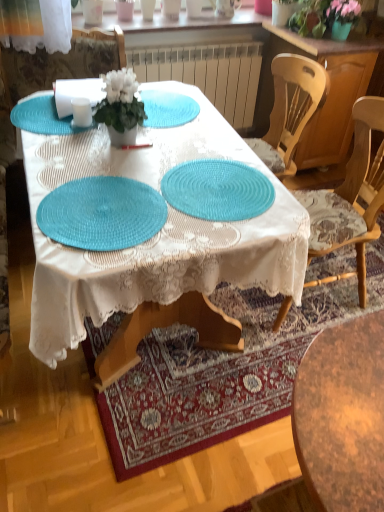
Identify the location of vacant space in front of white glossy cup at upper center. (139, 22).